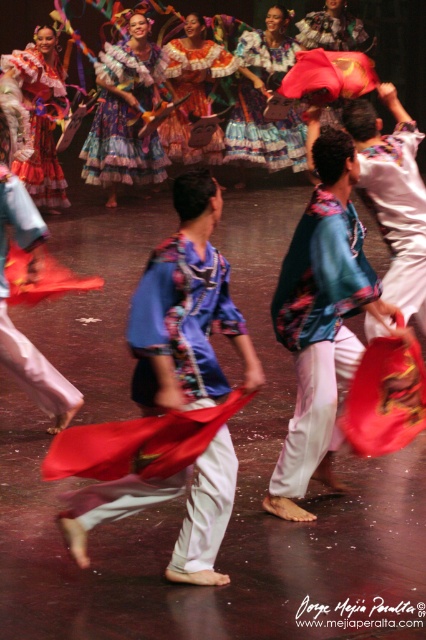
Question: Can you confirm if silky blue blouse at center is thinner than matte red skirt at upper left?

Choices:
 (A) no
 (B) yes

Answer: (B)

Question: Which of the following is the farthest from the observer?

Choices:
 (A) (402, 147)
 (B) (321, 428)

Answer: (A)

Question: Estimate the real-world distances between objects in this image. Which object is farther from the multicolored fringed skirt at upper center?

Choices:
 (A) teal floral blouse at center
 (B) matte blue fabric at center

Answer: (B)

Question: Does multicolored fringed skirt at upper center have a greater width compared to matte red skirt at upper left?

Choices:
 (A) yes
 (B) no

Answer: (A)

Question: Can you confirm if matte blue fabric at center is positioned to the left of multicolored satin dress at center?

Choices:
 (A) no
 (B) yes

Answer: (A)

Question: Among these objects, which one is farthest from the camera?

Choices:
 (A) multicolored fringed skirt at upper center
 (B) multicolored satin dress at center
 (C) matte red skirt at upper left
 (D) teal floral blouse at center

Answer: (A)